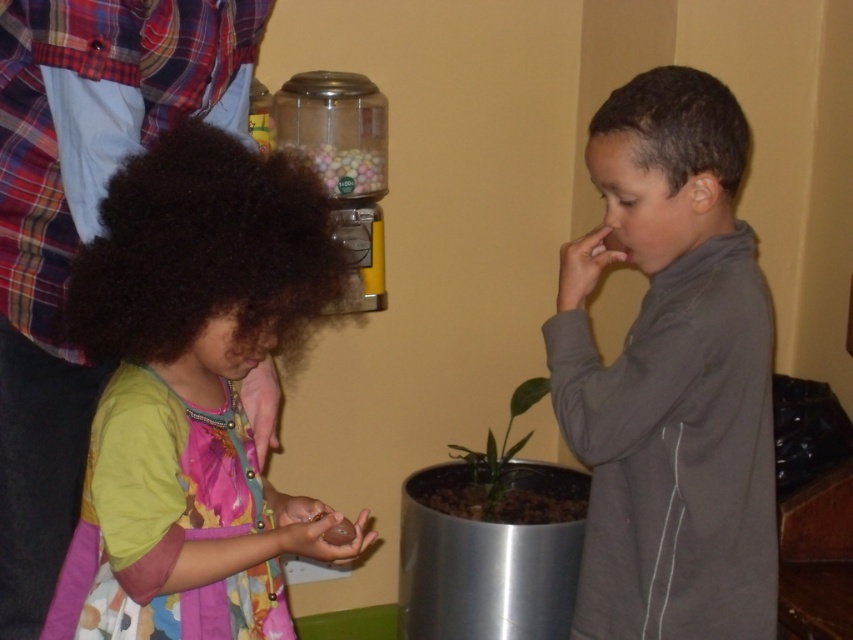
You are a parent trying to organize toys. You have a matte green dress at left and a chocolate matte at lower left. Which object is wider?

The matte green dress at left is wider than the chocolate matte at lower left.

You are a child trying to reach the chocolate matte at lower left but there is a translucent plastic jar at upper center in your way. Which object is closer to you?

The translucent plastic jar at upper center is closer to you than the chocolate matte at lower left because it is further to the viewer.

You are a photographer standing in front of the gumball machine. You want to take a photo that includes both the point at coordinates point (553,410) and point (340,528). Which point should you focus on first to ensure both are in focus?

You should focus on point (553,410) first because it is closer to the camera than point (340,528). By focusing on the closer point, the farther point will also be within the depth of field, ensuring both are in focus.